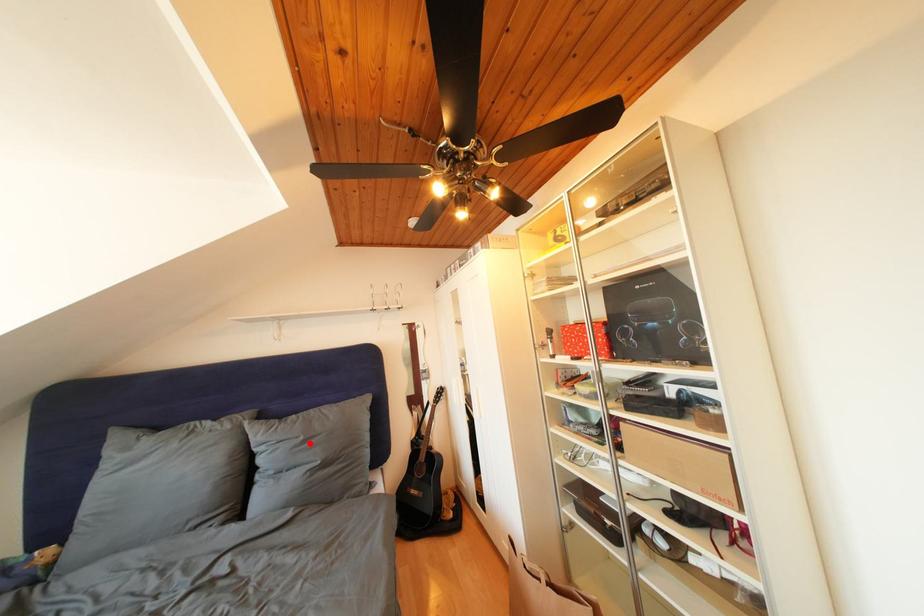
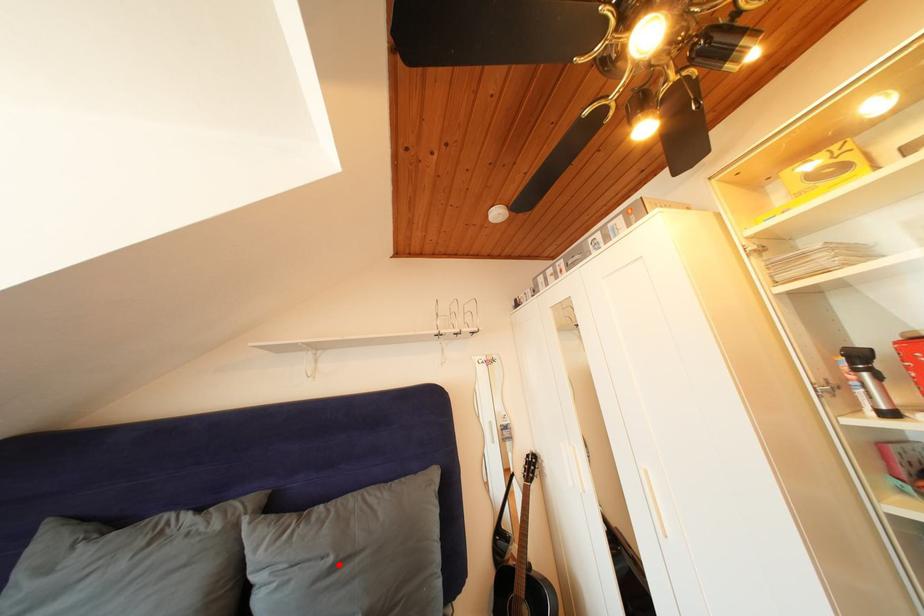
I am providing you with two images of the same scene from different viewpoints. A red point is marked on the first image and another point is marked on the second image. Do the highlighted points in image1 and image2 indicate the same real-world spot?

Yes